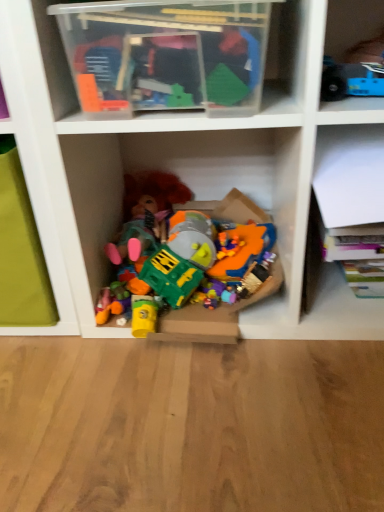
Question: Considering the positions of point (309, 301) and point (228, 309), is point (309, 301) closer or farther from the camera than point (228, 309)?

Choices:
 (A) closer
 (B) farther

Answer: (B)

Question: Considering the relative positions of white paper at upper right, the second shelf in the top-to-bottom sequence, and plastic toys at center, the first toy when ordered from bottom to top, in the image provided, is white paper at upper right, the second shelf in the top-to-bottom sequence, to the left or to the right of plastic toys at center, the first toy when ordered from bottom to top,?

Choices:
 (A) right
 (B) left

Answer: (A)

Question: Based on their relative distances, which object is nearer to the plastic toys at center, which is the 2th toy from top to bottom?

Choices:
 (A) white paper at upper right, the 2th shelf positioned from the left
 (B) transparent plastic container at upper center, the second shelf from the right
 (C) blue plastic toy at upper right, the first toy from the top

Answer: (A)

Question: Which object is positioned closest to the plastic toys at center, the second toy when ordered from front to back?

Choices:
 (A) transparent plastic container at upper center, the second shelf from the right
 (B) blue plastic toy at upper right, marked as the 2th toy in a left-to-right arrangement
 (C) white paper at upper right, the 2th shelf positioned from the left

Answer: (C)